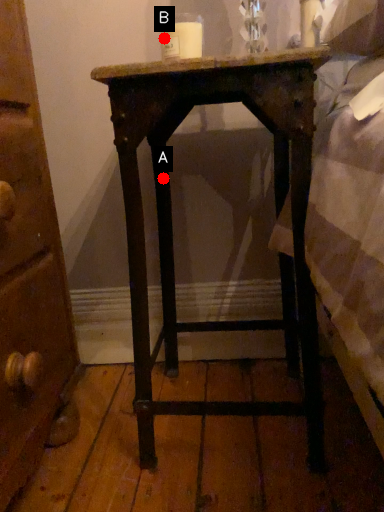
Question: Two points are circled on the image, labeled by A and B beside each circle. Which of the following is the farthest from the observer?

Choices:
 (A) A is further
 (B) B is further

Answer: (A)